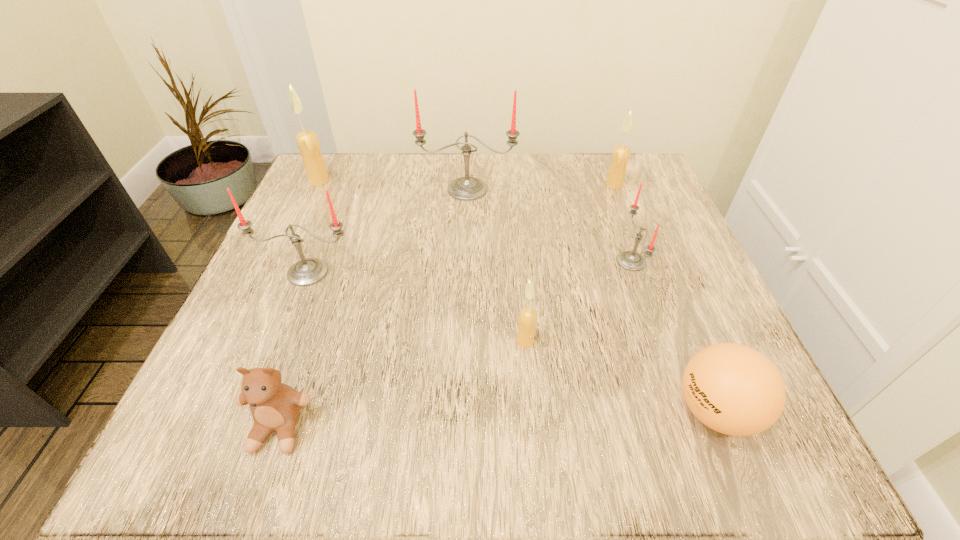
This screenshot has width=960, height=540. I want to click on free region at the near edge of the desktop, so click(549, 413).

You are a GUI agent. You are given a task and a screenshot of the screen. Output one action in this format:
    pyautogui.click(x=<x>, y=<y>)
    Task: Click on the free space at the left edge of the desktop
    This screenshot has height=540, width=960.
    Given the screenshot: What is the action you would take?
    pyautogui.click(x=305, y=336)

Where is `vacant space at the right edge of the desktop`? vacant space at the right edge of the desktop is located at coordinates (630, 221).

Locate an element on the screen. This screenshot has height=540, width=960. vacant space at the far left corner of the desktop is located at coordinates (348, 171).

Image resolution: width=960 pixels, height=540 pixels. Find the location of `free space at the near left corner`. free space at the near left corner is located at coordinates (186, 443).

You are a GUI agent. You are given a task and a screenshot of the screen. Output one action in this format:
    pyautogui.click(x=<x>, y=<y>)
    Task: Click on the vacant area at the far right corner of the desktop
    
    Given the screenshot: What is the action you would take?
    pyautogui.click(x=600, y=176)

You are a GUI agent. You are given a task and a screenshot of the screen. Output one action in this format:
    pyautogui.click(x=<x>, y=<y>)
    Task: Click on the free space between the smallest red candle and the second biggest red candle
    The width and height of the screenshot is (960, 540).
    Given the screenshot: What is the action you would take?
    pyautogui.click(x=469, y=267)

Identify the location of free spot between the biggest red candle and the rightmost cream candle. The image size is (960, 540). (540, 187).

Locate an element on the screen. This screenshot has height=540, width=960. vacant point located between the teddy bear and the nearest cream candle is located at coordinates (402, 384).

This screenshot has width=960, height=540. What are the coordinates of `free space between the farthest red candle and the ping-pong ball` in the screenshot? It's located at (591, 300).